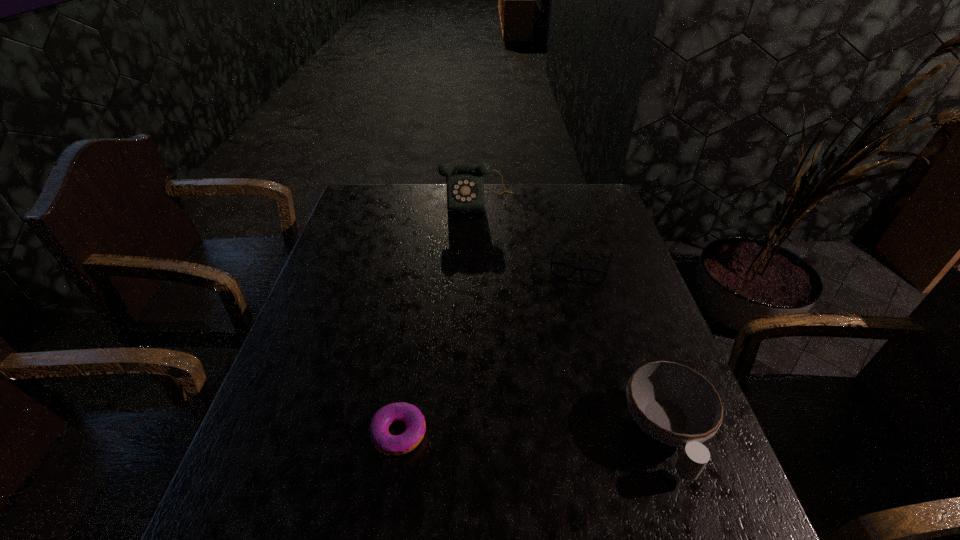
You are a GUI agent. You are given a task and a screenshot of the screen. Output one action in this format:
    pyautogui.click(x=<x>, y=<y>)
    Task: Click on the vacant space located 0.300m on the dial of the tallest object
    Image resolution: width=960 pixels, height=540 pixels.
    Given the screenshot: What is the action you would take?
    pyautogui.click(x=487, y=273)

The image size is (960, 540). Identify the location of free space located on the dial of the tallest object. (483, 240).

The height and width of the screenshot is (540, 960). Find the location of `vacant area situated on the dial of the tallest object`. vacant area situated on the dial of the tallest object is located at coordinates (483, 238).

Where is `object that is at the far edge`? This screenshot has height=540, width=960. object that is at the far edge is located at coordinates (465, 186).

Locate an element on the screen. doughnut present at the near edge is located at coordinates (394, 445).

Where is `chinaware present at the near edge`? The height and width of the screenshot is (540, 960). chinaware present at the near edge is located at coordinates (674, 404).

The height and width of the screenshot is (540, 960). Find the location of `chinaware at the right edge`. chinaware at the right edge is located at coordinates (674, 404).

The height and width of the screenshot is (540, 960). In order to click on spectacles located at the right edge in this screenshot , I will do click(562, 270).

Find the location of `object that is at the near right corner`. object that is at the near right corner is located at coordinates (674, 404).

What are the coordinates of `vacant space at the far edge` in the screenshot? It's located at (435, 184).